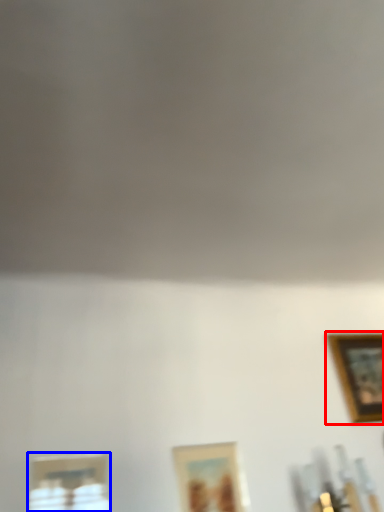
Question: Among these objects, which one is farthest to the camera, picture frame (highlighted by a red box) or picture frame (highlighted by a blue box)?

Choices:
 (A) picture frame
 (B) picture frame

Answer: (A)